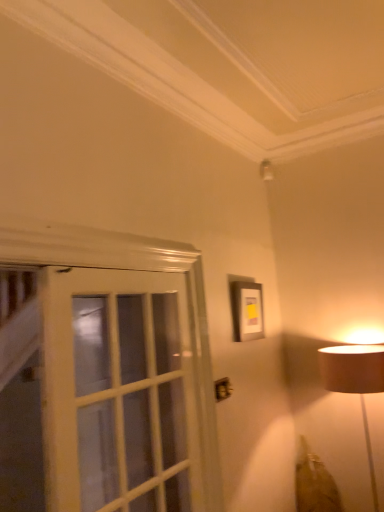
Question: Should I look upward or downward to see matte black picture frame at upper center?

Choices:
 (A) down
 (B) up

Answer: (A)

Question: Is matte black picture frame at upper center surrounding white glass screen door at left?

Choices:
 (A) no
 (B) yes

Answer: (A)

Question: Is matte black picture frame at upper center positioned beyond the bounds of white glass screen door at left?

Choices:
 (A) no
 (B) yes

Answer: (B)

Question: Does matte black picture frame at upper center have a greater height compared to white glass screen door at left?

Choices:
 (A) yes
 (B) no

Answer: (B)

Question: From the image's perspective, is matte black picture frame at upper center on white glass screen door at left?

Choices:
 (A) yes
 (B) no

Answer: (A)

Question: Does matte black picture frame at upper center have a greater width compared to white glass screen door at left?

Choices:
 (A) yes
 (B) no

Answer: (B)

Question: Is matte black picture frame at upper center beside white glass screen door at left?

Choices:
 (A) yes
 (B) no

Answer: (B)

Question: Can you see white glass screen door at left touching matte black picture frame at upper center?

Choices:
 (A) yes
 (B) no

Answer: (B)

Question: Can you confirm if white glass screen door at left is wider than matte black picture frame at upper center?

Choices:
 (A) yes
 (B) no

Answer: (A)

Question: Considering the relative sizes of white glass screen door at left and matte black picture frame at upper center in the image provided, is white glass screen door at left shorter than matte black picture frame at upper center?

Choices:
 (A) no
 (B) yes

Answer: (A)

Question: From a real-world perspective, is white glass screen door at left below matte black picture frame at upper center?

Choices:
 (A) no
 (B) yes

Answer: (B)

Question: Can you confirm if white glass screen door at left is bigger than matte black picture frame at upper center?

Choices:
 (A) no
 (B) yes

Answer: (B)

Question: From a real-world perspective, is white glass screen door at left positioned over matte black picture frame at upper center based on gravity?

Choices:
 (A) yes
 (B) no

Answer: (B)

Question: From their relative heights in the image, would you say matte black picture frame at upper center is taller or shorter than white glass screen door at left?

Choices:
 (A) short
 (B) tall

Answer: (A)